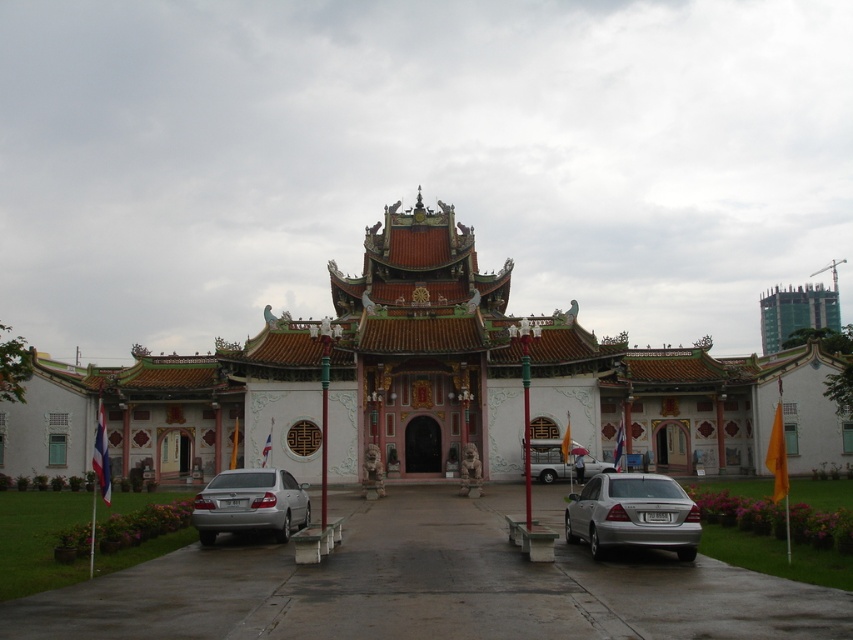
You are standing in front of a traditional Chinese building and want to take a photo of the point at coordinate point [236,461]. If the camera can focus on objects within 100 meters, will it be able to capture that point clearly?

The point [236,461] is 80.91 meters away from the camera, so yes, the camera can focus on it clearly since it is within the 100 meters range.

You are a visitor standing at the entrance of the white glossy palace at center and want to park your silver metallic sedan at lower left. Is the sedan wide enough to fit through the entrance without touching the sides?

The white glossy palace at center is wider than the silver metallic sedan at lower left, so the sedan should be able to pass through the entrance without touching the sides.

You are standing at the entrance of the building and want to take a photo of the white glossy palace at center. Which direction should you face to capture it in the frame?

Since the white glossy palace at center is located at point (422, 353), you should face towards the center of the building to capture it in the frame.